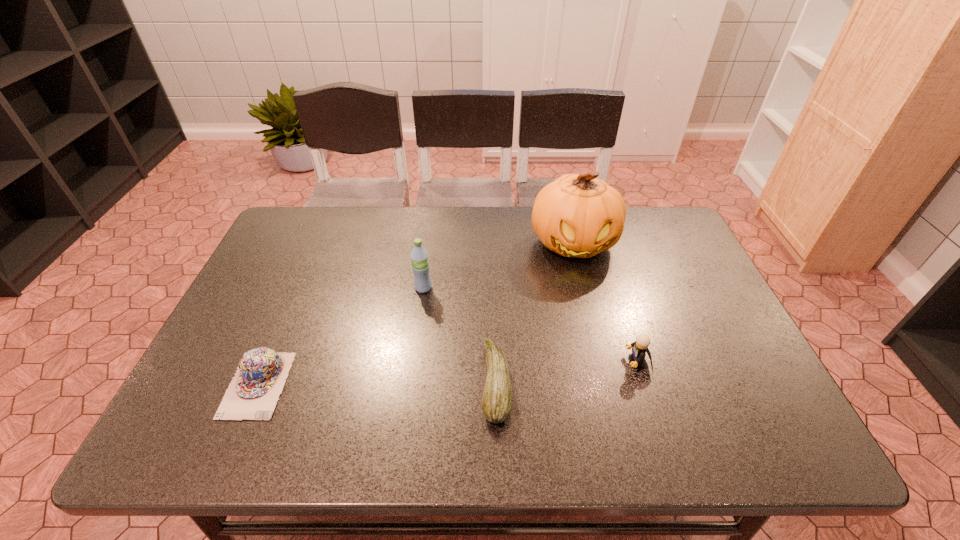
This screenshot has width=960, height=540. Find the location of `vacant space located on the front-facing side of the Lego`. vacant space located on the front-facing side of the Lego is located at coordinates (458, 362).

At what (x,y) coordinates should I click in order to perform the action: click on free space located on the front-facing side of the Lego. Please return your answer as a coordinate pair (x, y). This screenshot has width=960, height=540. Looking at the image, I should click on (516, 362).

This screenshot has width=960, height=540. In order to click on free space located 0.150m at the stem end of the third object from left to right in this screenshot , I will do `click(416, 383)`.

At what (x,y) coordinates should I click in order to perform the action: click on vacant space located at the stem end of the third object from left to right. Please return your answer as a coordinate pair (x, y). This screenshot has height=540, width=960. Looking at the image, I should click on (424, 383).

Locate an element on the screen. free region located 0.390m at the stem end of the third object from left to right is located at coordinates (311, 383).

The width and height of the screenshot is (960, 540). I want to click on object situated at the far edge, so click(576, 215).

Locate an element on the screen. The width and height of the screenshot is (960, 540). zucchini present at the near edge is located at coordinates (497, 398).

Find the location of a particular element. Image resolution: width=960 pixels, height=540 pixels. cap that is at the near edge is located at coordinates (252, 394).

Where is `object that is at the left edge`? Image resolution: width=960 pixels, height=540 pixels. object that is at the left edge is located at coordinates (252, 394).

This screenshot has height=540, width=960. In order to click on object present at the near left corner in this screenshot , I will do `click(252, 394)`.